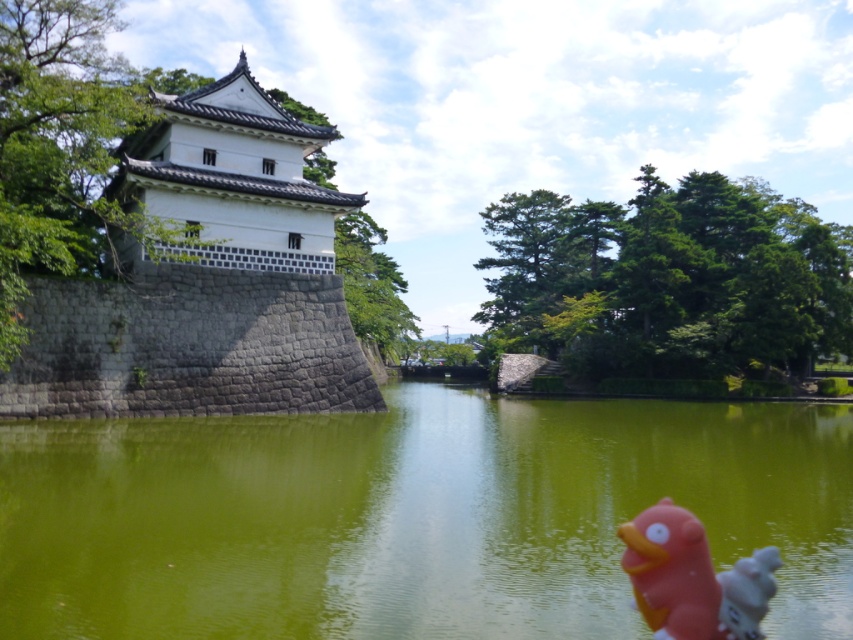
Does green stone water at center appear over rubber duck at lower right?

Correct, green stone water at center is located above rubber duck at lower right.

Can you confirm if green stone water at center is thinner than rubber duck at lower right?

In fact, green stone water at center might be wider than rubber duck at lower right.

The image size is (853, 640). What do you see at coordinates (410, 516) in the screenshot?
I see `green stone water at center` at bounding box center [410, 516].

Identify the location of green stone water at center. The image size is (853, 640). (410, 516).

Which is more to the right, green stone water at center or white stone wall at left?

green stone water at center is more to the right.

Describe the element at coordinates (410, 516) in the screenshot. I see `green stone water at center` at that location.

Is point (9, 611) positioned before point (61, 349)?

Yes, it is in front of point (61, 349).

Image resolution: width=853 pixels, height=640 pixels. I want to click on green stone water at center, so click(x=410, y=516).

Between point (39, 401) and point (650, 525), which one is positioned behind?

The point (39, 401) is behind.

Between white stone wall at left and rubber duck at lower right, which one appears on the right side from the viewer's perspective?

rubber duck at lower right is more to the right.

Who is more distant from viewer, (x=260, y=176) or (x=762, y=586)?

The point (x=260, y=176) is more distant.

At what (x,y) coordinates should I click in order to perform the action: click on white stone wall at left. Please return your answer as a coordinate pair (x, y). Looking at the image, I should click on (206, 280).